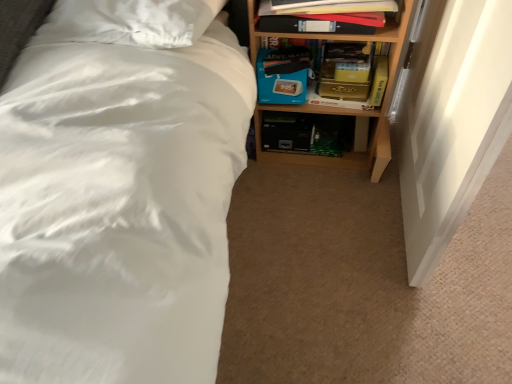
Question: Considering the relative positions of blue cardboard box at center and matte black book at upper right, which is the first book from back to front, in the image provided, is blue cardboard box at center to the left or to the right of matte black book at upper right, which is the first book from back to front,?

Choices:
 (A) right
 (B) left

Answer: (B)

Question: In terms of size, does blue cardboard box at center appear bigger or smaller than matte black book at upper right, the 2th book viewed from the front?

Choices:
 (A) big
 (B) small

Answer: (B)

Question: Considering the real-world distances, which object is closest to the yellow matte paperback book at right?

Choices:
 (A) matte black book at upper right, marked as the first book in a front-to-back arrangement
 (B) blue cardboard box at center
 (C) matte black book at upper right, which is the first book from back to front
 (D) wooden bookshelf at upper right

Answer: (C)

Question: Which of these objects is positioned closest to the blue cardboard box at center?

Choices:
 (A) yellow matte paperback book at right
 (B) matte black book at upper right, marked as the first book in a front-to-back arrangement
 (C) wooden bookshelf at upper right
 (D) matte black book at upper right, which is the first book from back to front

Answer: (D)